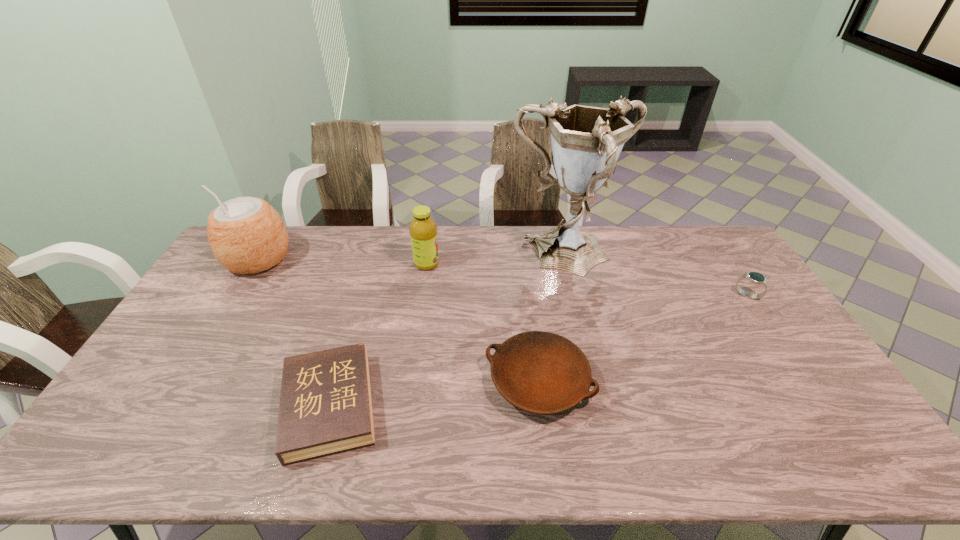
Identify the location of vacant space located on the back of the coconut. (278, 226).

This screenshot has height=540, width=960. What are the coordinates of `free space located 0.360m on the front label of the third tallest object` in the screenshot? It's located at (541, 264).

The image size is (960, 540). I want to click on blank space located on the back of the watch, so click(x=733, y=275).

I want to click on free space located 0.110m on the back of the plate, so click(x=531, y=316).

Image resolution: width=960 pixels, height=540 pixels. Identify the location of vacant point located on the right of the shortest object. (531, 406).

Identify the location of trophy cup that is positioned at the far edge. This screenshot has height=540, width=960. 586,141.

Image resolution: width=960 pixels, height=540 pixels. Identify the location of coconut situated at the far edge. (246, 234).

Identify the location of fruit juice that is at the far edge. The image size is (960, 540). (423, 230).

Identify the location of object that is at the near edge. (325, 406).

The image size is (960, 540). I want to click on object positioned at the left edge, so click(246, 234).